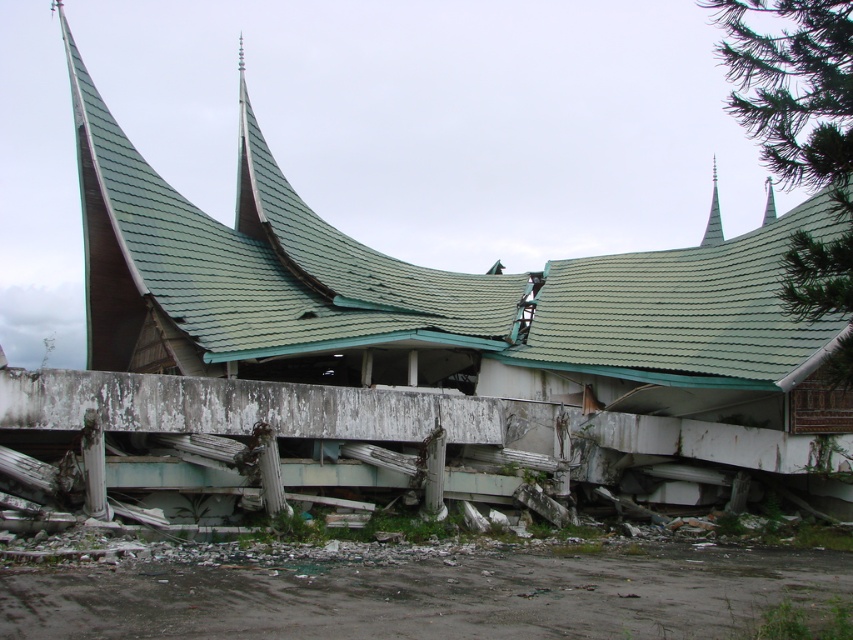
Question: Does green tile spire at upper center lie in front of green shingled spire at upper center?

Choices:
 (A) no
 (B) yes

Answer: (B)

Question: Which of the following is the closest to the observer?

Choices:
 (A) green shingled spire at upper center
 (B) green tile spire at upper center

Answer: (B)

Question: Can you confirm if green tile spire at upper center is positioned to the left of green shingled spire at upper center?

Choices:
 (A) no
 (B) yes

Answer: (B)

Question: Can you confirm if green tile spire at upper center is wider than green shingled spire at upper center?

Choices:
 (A) no
 (B) yes

Answer: (A)

Question: Which of the following is the farthest from the observer?

Choices:
 (A) (715, 230)
 (B) (770, 202)

Answer: (B)

Question: Which point appears closest to the camera in this image?

Choices:
 (A) (769, 189)
 (B) (704, 243)

Answer: (B)